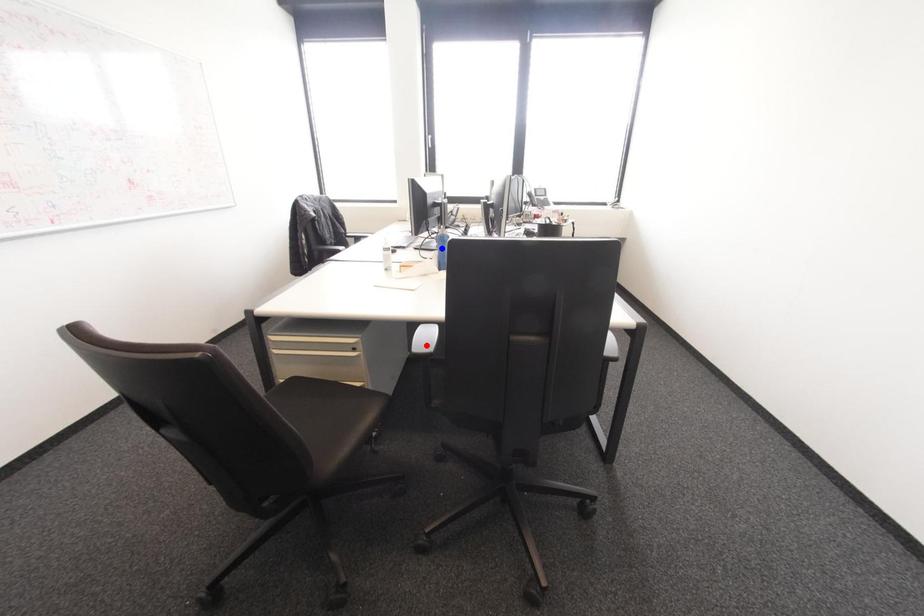
Question: Which of the two points in the image is closer to the camera?

Choices:
 (A) Blue point is closer.
 (B) Red point is closer.

Answer: (B)